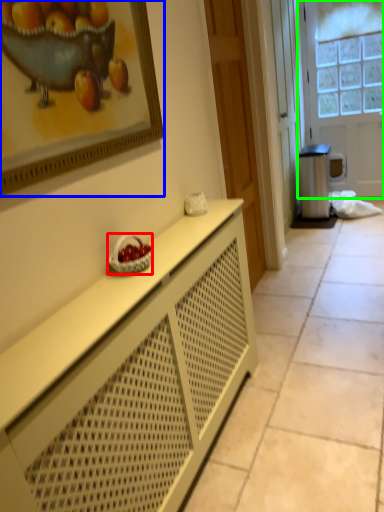
Question: Which object is positioned closest to fruit dish (highlighted by a red box)? Select from picture frame (highlighted by a blue box) and door (highlighted by a green box).

Choices:
 (A) picture frame
 (B) door

Answer: (A)